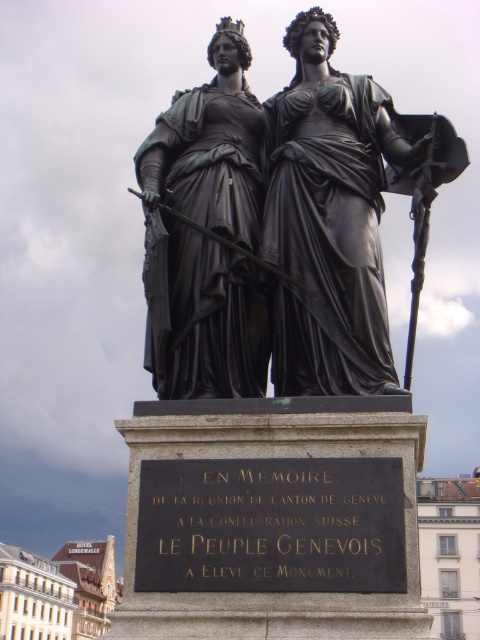
Question: Which object is positioned closest to the matte black statue at center?

Choices:
 (A) black metal plaque at center
 (B) black polished statue at center

Answer: (B)

Question: Is black polished statue at center above matte black statue at center?

Choices:
 (A) yes
 (B) no

Answer: (A)

Question: Considering the real-world distances, which object is closest to the black polished statue at center?

Choices:
 (A) matte black statue at center
 (B) black metal plaque at center

Answer: (A)

Question: Considering the relative positions of black polished statue at center and matte black statue at center in the image provided, where is black polished statue at center located with respect to matte black statue at center?

Choices:
 (A) right
 (B) left

Answer: (A)

Question: Does matte black statue at center come in front of black metal plaque at center?

Choices:
 (A) yes
 (B) no

Answer: (B)

Question: Based on their relative distances, which object is farther from the matte black statue at center?

Choices:
 (A) black metal plaque at center
 (B) black polished statue at center

Answer: (A)